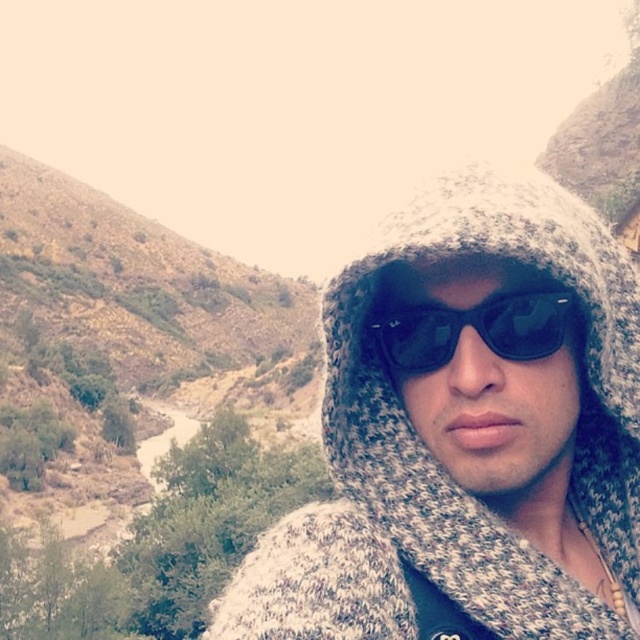
Question: In this image, where is knitted woolen hoodie at center located relative to black reflective sunglasses at center?

Choices:
 (A) below
 (B) above

Answer: (A)

Question: Does knitted woolen hoodie at center appear over black reflective sunglasses at center?

Choices:
 (A) no
 (B) yes

Answer: (A)

Question: Which object is farther from the camera taking this photo?

Choices:
 (A) black reflective sunglasses at center
 (B) knitted woolen hoodie at center

Answer: (A)

Question: Does knitted woolen hoodie at center have a larger size compared to black reflective sunglasses at center?

Choices:
 (A) no
 (B) yes

Answer: (B)